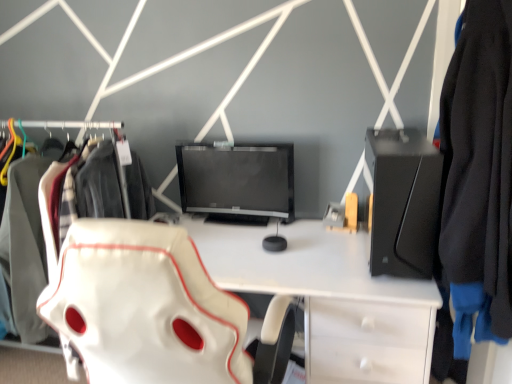
Identify the location of vacant area situated below matte black monitor at center (from a real-world perspective). (253, 223).